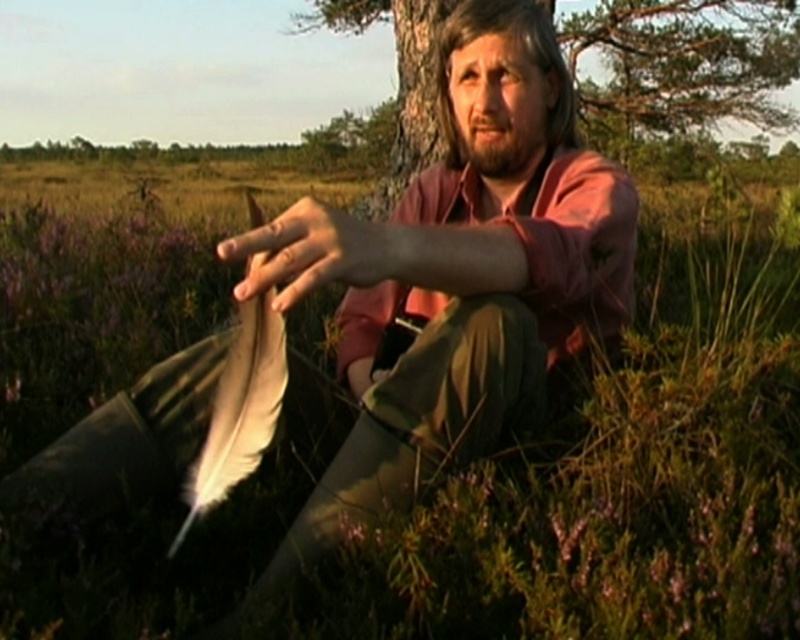
You are a nature researcher who has just found two feathers in the marshland. You need to determine their positions relative to each other. Which feather is closer to you when you look at the matte brown feather at center and the white feather at center?

The matte brown feather at center is closer to you because the white feather at center is positioned behind it.

You are a wildlife researcher observing the scene. You notice the brown rough tree at upper center and the brown fuzzy hair at upper center. Which object is positioned higher in the image?

The brown rough tree at upper center is located above the brown fuzzy hair at upper center, so it is positioned higher in the image.